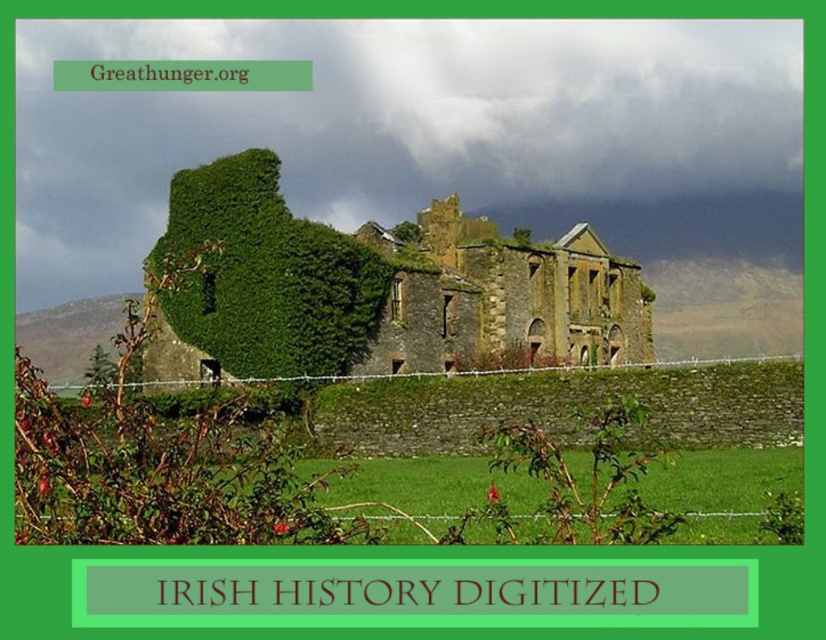
Who is lower down, green mossy stone building at center or stone wall at center?

green mossy stone building at center is lower down.

Image resolution: width=826 pixels, height=640 pixels. In order to click on green mossy stone building at center in this screenshot , I will do `click(376, 289)`.

Does point (480, 305) come closer to viewer compared to point (584, 323)?

Yes.

In order to click on green mossy stone building at center in this screenshot , I will do `click(376, 289)`.